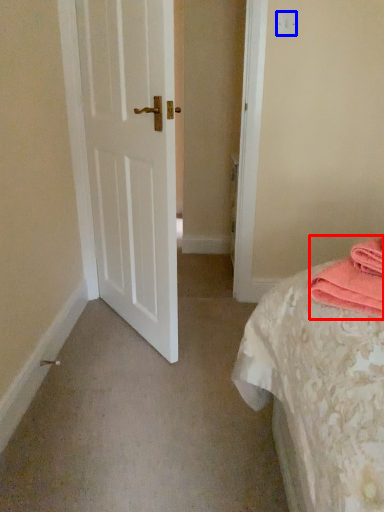
Question: Which of the following is the farthest to the observer, material (highlighted by a red box) or light switch (highlighted by a blue box)?

Choices:
 (A) material
 (B) light switch

Answer: (B)